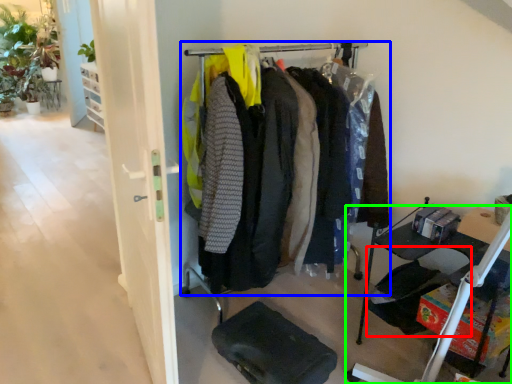
Question: Based on their relative distances, which object is farther from folding chair (highlighted by a red box)? Choose from closet (highlighted by a blue box) and furniture (highlighted by a green box).

Choices:
 (A) closet
 (B) furniture

Answer: (A)